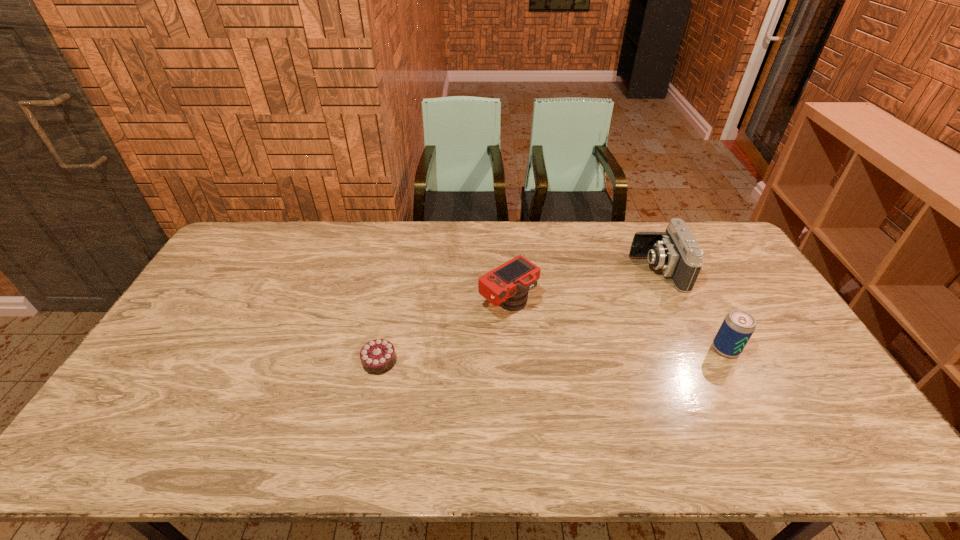
Identify the location of vacant area that lies between the left camera and the beer can. (617, 327).

Identify the location of vacant area between the second object from left to right and the chocolate cake. (444, 333).

Where is `vacant point located between the left camera and the beer can`? The width and height of the screenshot is (960, 540). vacant point located between the left camera and the beer can is located at coordinates (617, 327).

I want to click on vacant area that lies between the right camera and the beer can, so click(691, 310).

At what (x,y) coordinates should I click in order to perform the action: click on vacant region between the beer can and the chocolate cake. Please return your answer as a coordinate pair (x, y). This screenshot has width=960, height=540. Looking at the image, I should click on (552, 355).

You are a GUI agent. You are given a task and a screenshot of the screen. Output one action in this format:
    pyautogui.click(x=<x>, y=<y>)
    Task: Click on the empty location between the left camera and the right camera
    
    Given the screenshot: What is the action you would take?
    pyautogui.click(x=583, y=287)

Identify which object is the second closest to the right camera. Please provide its 2D coordinates. Your answer should be formatted as a tuple, i.e. [(x, y)], where the tuple contains the x and y coordinates of a point satisfying the conditions above.

[(507, 285)]

At what (x,y) coordinates should I click in order to perform the action: click on object that is the third closest one to the right camera. Please return your answer as a coordinate pair (x, y). Looking at the image, I should click on (378, 356).

This screenshot has height=540, width=960. I want to click on free space that satisfies the following two spatial constraints: 1. on the back side of the left camera; 2. on the right side of the shortest object, so click(392, 304).

The width and height of the screenshot is (960, 540). I want to click on vacant region that satisfies the following two spatial constraints: 1. at the front of the beer can with an open lens cover; 2. on the left side of the right camera, so click(x=693, y=349).